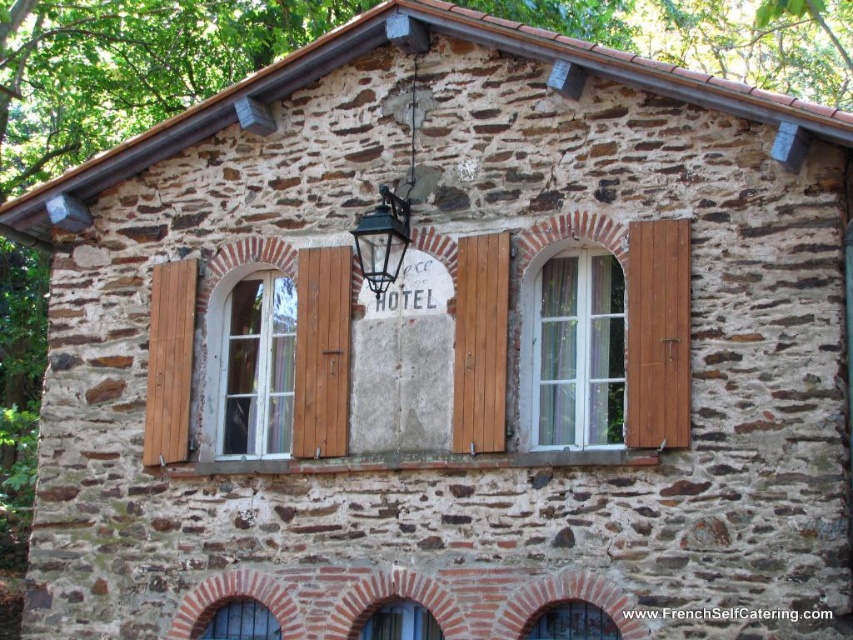
You are a guest at the hotel and want to open a window to let in some fresh air. Which window should you choose between the wooden at left and the clear glass window at center? Explain why based on their positions.

The clear glass window at center is behind the wooden at left, so you should choose the wooden at left to open since it is accessible from your current position.

You are an architect assessing the building facade. You need to determine which of the two elements, the wooden at left or the matte stone arch at lower center, requires more vertical space for structural support. Based on the image, which one do you think needs more vertical space?

The matte stone arch at lower center requires more vertical space for structural support because it is taller than the wooden at left.

You are a painter who needs to cover the wooden at left and the clear glass window at center with paint. Which object requires more paint in terms of width?

The clear glass window at center requires more paint in terms of width since it has a greater width than the wooden at left.